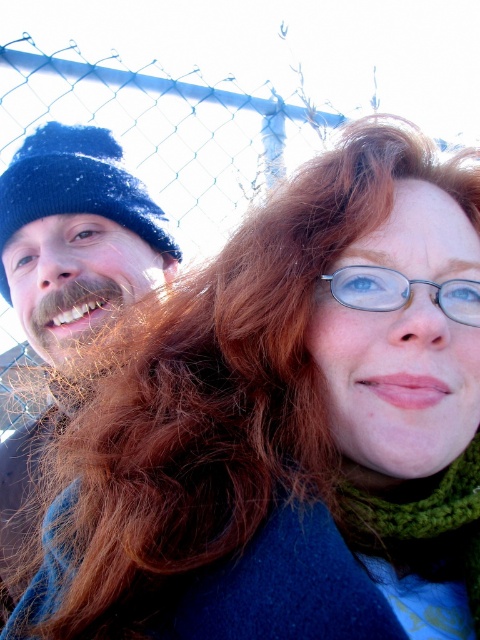
You are a photographer trying to capture a closeup shot of both the dark blue knit hat at left and the green knitted scarf at lower right. Given that your camera has a depth of field that can focus on objects within 30 inches of each other, will you need to adjust your focus to get both items in focus?

The dark blue knit hat at left is 32.18 inches away from the green knitted scarf at lower right. Since the distance exceeds the 30 inches depth of field range, you will need to adjust your focus to ensure both items are in focus.

You are a photographer trying to capture a clear shot of the metallic silver glasses at upper center. However, the green knitted scarf at lower right is blocking your view. Can you determine if the scarf is in front of or behind the glasses?

The green knitted scarf at lower right is in front of the metallic silver glasses at upper center, so it is blocking the view.

You are taking a photo of two people standing near a chain link fence. You notice two points in the image labeled as point (96, 195) and point (367, 304). Which point is closer to the camera?

Point (96, 195) is further to the camera than point (367, 304), so point (96, 195) is closer to the camera.